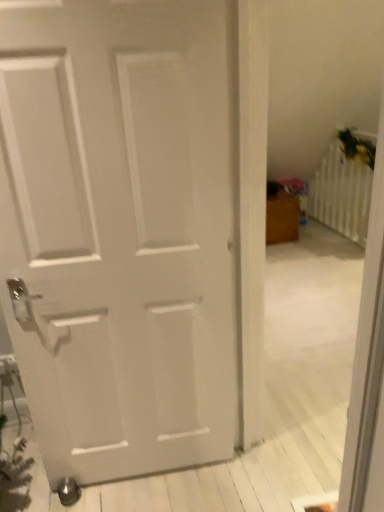
Question: Considering the relative positions of white matte door at center and white plastic radiator at upper right in the image provided, is white matte door at center to the left or to the right of white plastic radiator at upper right?

Choices:
 (A) left
 (B) right

Answer: (A)

Question: Is white matte door at center wider or thinner than white plastic radiator at upper right?

Choices:
 (A) thin
 (B) wide

Answer: (B)

Question: Is white matte door at center taller or shorter than white plastic radiator at upper right?

Choices:
 (A) tall
 (B) short

Answer: (A)

Question: Looking at their shapes, would you say white plastic radiator at upper right is wider or thinner than white matte door at center?

Choices:
 (A) wide
 (B) thin

Answer: (B)

Question: Is white plastic radiator at upper right spatially inside white matte door at center, or outside of it?

Choices:
 (A) outside
 (B) inside

Answer: (A)

Question: In terms of height, does white plastic radiator at upper right look taller or shorter compared to white matte door at center?

Choices:
 (A) tall
 (B) short

Answer: (B)

Question: From a real-world perspective, is white plastic radiator at upper right above or below white matte door at center?

Choices:
 (A) above
 (B) below

Answer: (B)